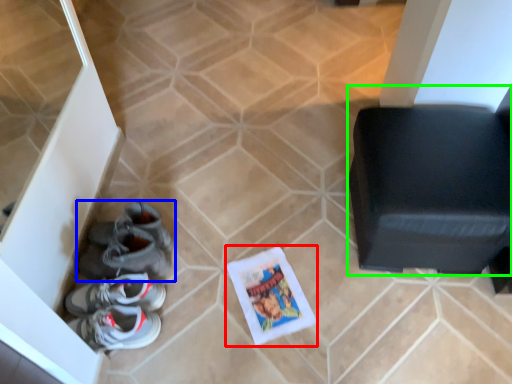
Question: Which is farther away from comic book (highlighted by a red box)? footwear (highlighted by a blue box) or furniture (highlighted by a green box)?

Choices:
 (A) footwear
 (B) furniture

Answer: (B)